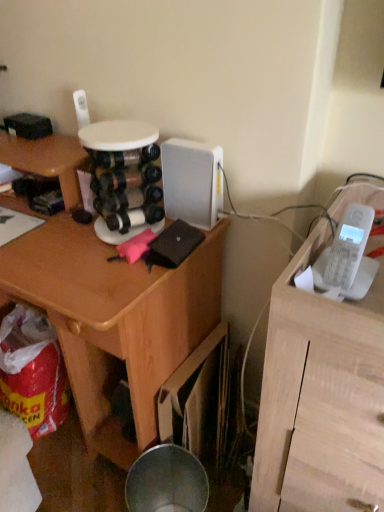
Question: From a real-world perspective, is white matte telephone at upper right located beneath white plastic phone at right?

Choices:
 (A) yes
 (B) no

Answer: (A)

Question: Can you see white matte telephone at upper right touching white plastic phone at right?

Choices:
 (A) yes
 (B) no

Answer: (B)

Question: Considering the relative positions of white matte telephone at upper right and white plastic phone at right in the image provided, is white matte telephone at upper right in front of white plastic phone at right?

Choices:
 (A) yes
 (B) no

Answer: (A)

Question: Is white plastic phone at right surrounded by white matte telephone at upper right?

Choices:
 (A) yes
 (B) no

Answer: (A)

Question: Can you confirm if white matte telephone at upper right is positioned to the left of white plastic phone at right?

Choices:
 (A) no
 (B) yes

Answer: (A)

Question: Is white matte telephone at upper right positioned far away from white plastic phone at right?

Choices:
 (A) no
 (B) yes

Answer: (A)

Question: Does white matte telephone at upper right have a lesser width compared to wooden desk at center?

Choices:
 (A) yes
 (B) no

Answer: (B)

Question: Is wooden desk at center at the back of white matte telephone at upper right?

Choices:
 (A) no
 (B) yes

Answer: (A)

Question: Does white matte telephone at upper right have a greater width compared to wooden desk at center?

Choices:
 (A) no
 (B) yes

Answer: (B)

Question: Is white matte telephone at upper right far from wooden desk at center?

Choices:
 (A) no
 (B) yes

Answer: (A)

Question: Does white matte telephone at upper right turn towards wooden desk at center?

Choices:
 (A) yes
 (B) no

Answer: (B)

Question: From a real-world perspective, is white matte telephone at upper right over wooden desk at center?

Choices:
 (A) no
 (B) yes

Answer: (B)

Question: From a real-world perspective, is wooden desk at center over white matte telephone at upper right?

Choices:
 (A) no
 (B) yes

Answer: (A)